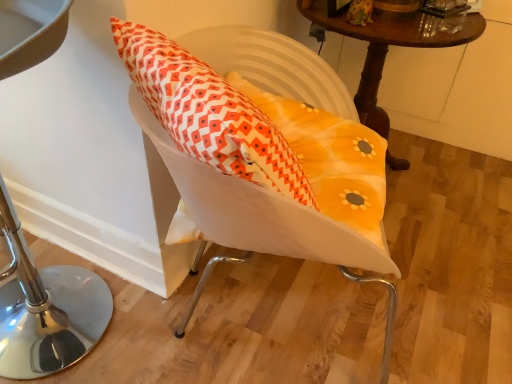
Question: From their relative heights in the image, would you say wooden table at upper right is taller or shorter than white fabric swivel chair at center?

Choices:
 (A) tall
 (B) short

Answer: (A)

Question: Is wooden table at upper right to the left or to the right of white fabric swivel chair at center in the image?

Choices:
 (A) left
 (B) right

Answer: (B)

Question: Considering the real-world distances, which object is farthest from the wooden table at upper right?

Choices:
 (A) metallic stool at left
 (B) white fabric swivel chair at center

Answer: (A)

Question: Which of these objects is positioned closest to the white fabric swivel chair at center?

Choices:
 (A) metallic stool at left
 (B) wooden table at upper right

Answer: (B)